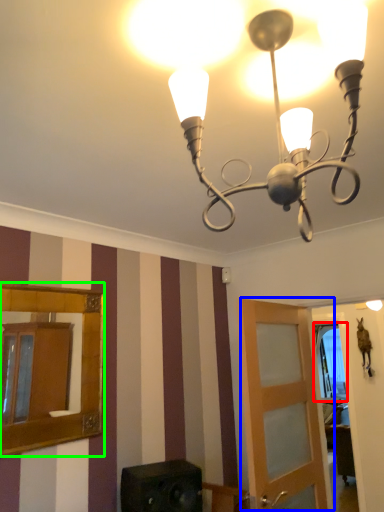
Question: Based on their relative distances, which object is nearer to window (highlighted by a red box)? Choose from door (highlighted by a blue box) and mirror (highlighted by a green box).

Choices:
 (A) door
 (B) mirror

Answer: (A)